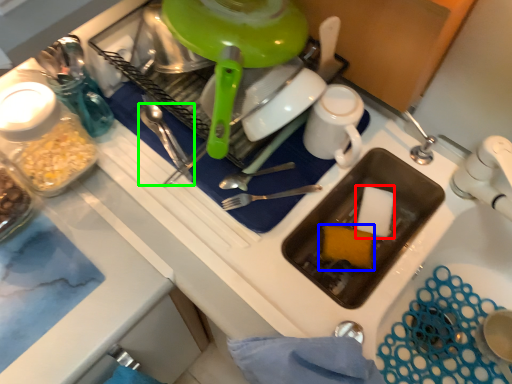
Question: Which is nearer to the food (highlighted by a red box)? food (highlighted by a blue box) or silverware (highlighted by a green box).

Choices:
 (A) food
 (B) silverware

Answer: (A)